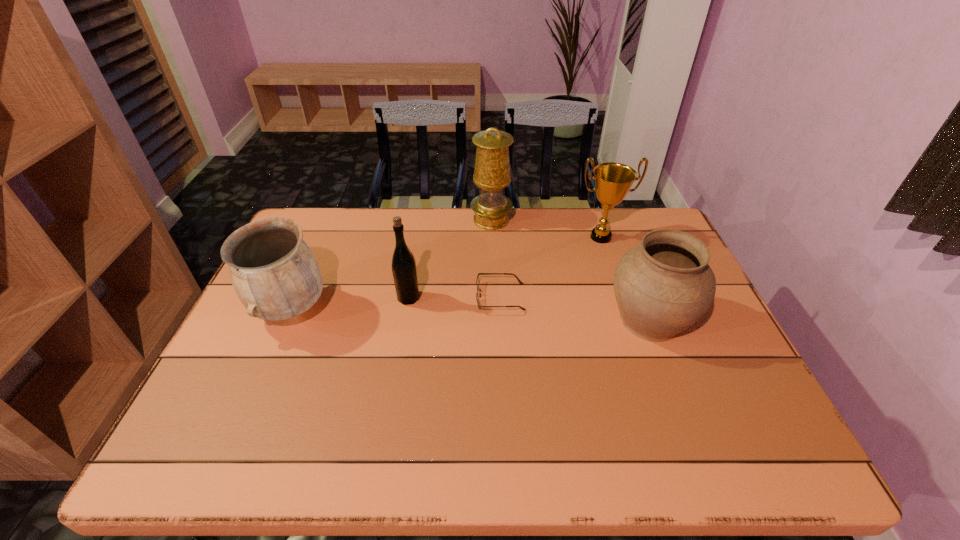
This screenshot has width=960, height=540. I want to click on oil lamp, so click(492, 167).

I want to click on award, so click(x=612, y=180).

Image resolution: width=960 pixels, height=540 pixels. What are the coordinates of `the second object from left to right` in the screenshot? It's located at (404, 271).

Find the location of a particular element. The height and width of the screenshot is (540, 960). the right urn is located at coordinates (664, 285).

The height and width of the screenshot is (540, 960). Identify the location of the left urn. (274, 273).

Find the location of a particular element. the shortest object is located at coordinates (477, 281).

This screenshot has width=960, height=540. Find the location of `free space located on the right of the oil lamp`. free space located on the right of the oil lamp is located at coordinates (585, 220).

Identify the location of vacant space positioned 0.140m on the front view with handles of the award. The height and width of the screenshot is (540, 960). (614, 279).

Locate an element on the screen. The height and width of the screenshot is (540, 960). free space located 0.390m on the left of the second object from left to right is located at coordinates (257, 298).

This screenshot has height=540, width=960. Find the location of `free space located 0.370m on the back of the right urn`. free space located 0.370m on the back of the right urn is located at coordinates (610, 216).